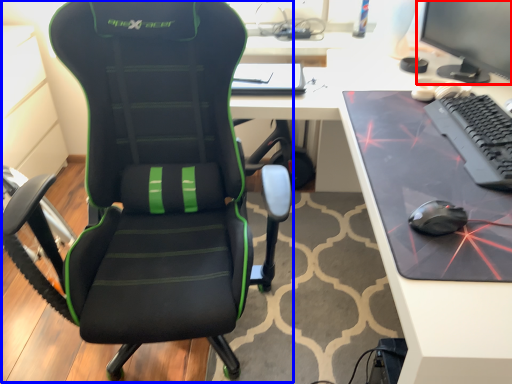
Question: Which point is further to the camera, computer monitor (highlighted by a red box) or chair (highlighted by a blue box)?

Choices:
 (A) computer monitor
 (B) chair

Answer: (A)